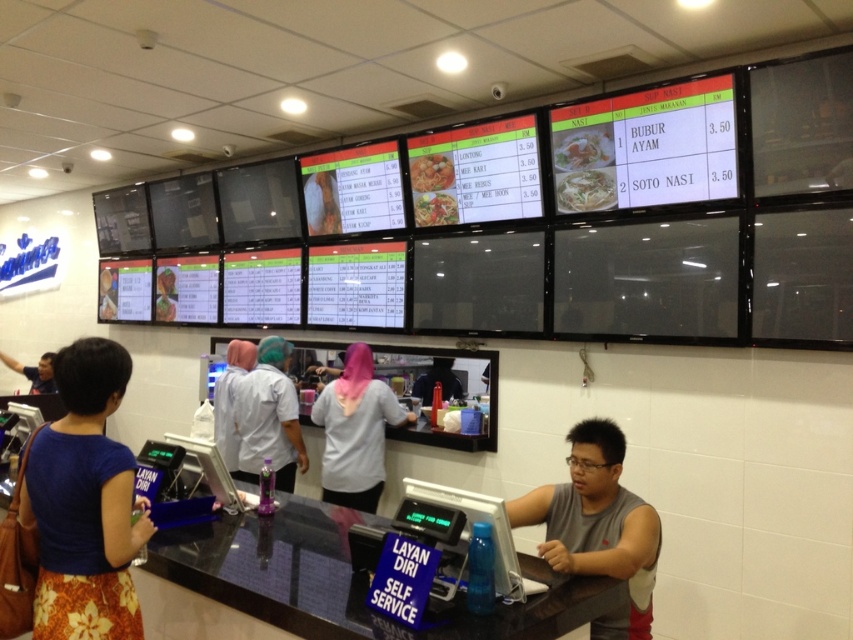
You are a customer standing in front of the counter at the food service area. You notice the white fabric uniform at center. Can you determine if the uniform is positioned closer to the top or bottom of the counter?

The white fabric uniform at center is located at point (230, 400), which places it closer to the bottom of the counter since the y coordinate 0.271 is closer to 0, which represents the bottom of the image.

In the scene shown: You are a customer standing at the counter in the food service area. You want to grab the shiny orange fried rice at center but need to avoid touching the white fabric uniform at center. Is there enough space between them for you to reach the fried rice without touching the uniform?

The white fabric uniform at center is 5.38 feet away from the shiny orange fried rice at center. Since 5.38 feet is a considerable distance, you can safely reach the shiny orange fried rice at center without touching the white fabric uniform at center.

You are a customer at the food service area and you want to order the shiny orange fried rice at center. The staff member is wearing the white fabric shirt at center. Can you tell me which one is bigger in size between the two?

The white fabric shirt at center is larger in size than the shiny orange fried rice at center.